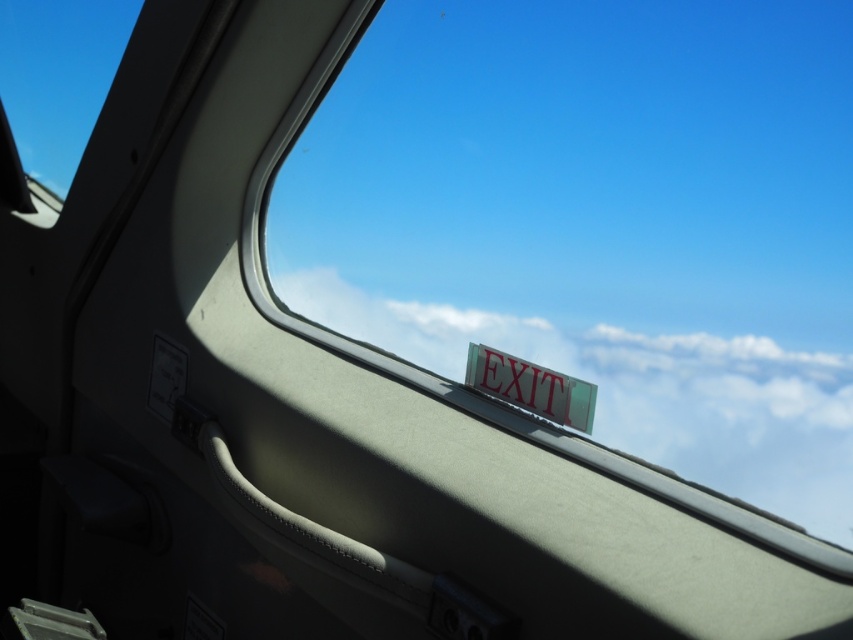
From the picture: Does white fluffy cloud at upper center lie behind red plastic exit sign at upper right?

No, white fluffy cloud at upper center is closer to the viewer.

Measure the distance between white fluffy cloud at upper center and red plastic exit sign at upper right.

white fluffy cloud at upper center is 5.24 inches away from red plastic exit sign at upper right.

Find the location of `white fluffy cloud at upper center`. white fluffy cloud at upper center is located at coordinates (610, 365).

Does white fluffy cloud at upper center have a greater width compared to transparent glass window at upper left?

Indeed, white fluffy cloud at upper center has a greater width compared to transparent glass window at upper left.

Does point (671, 349) come in front of point (57, 52)?

Yes, it is in front of point (57, 52).

In order to click on white fluffy cloud at upper center in this screenshot , I will do (610, 365).

Who is taller, transparent glass window at upper left or red plastic exit sign at upper right?

transparent glass window at upper left

Is point (73, 161) positioned in front of point (514, 372)?

That is False.

Between point (120, 51) and point (503, 378), which one is positioned in front?

Positioned in front is point (503, 378).

Where is `transparent glass window at upper left`? transparent glass window at upper left is located at coordinates (57, 76).